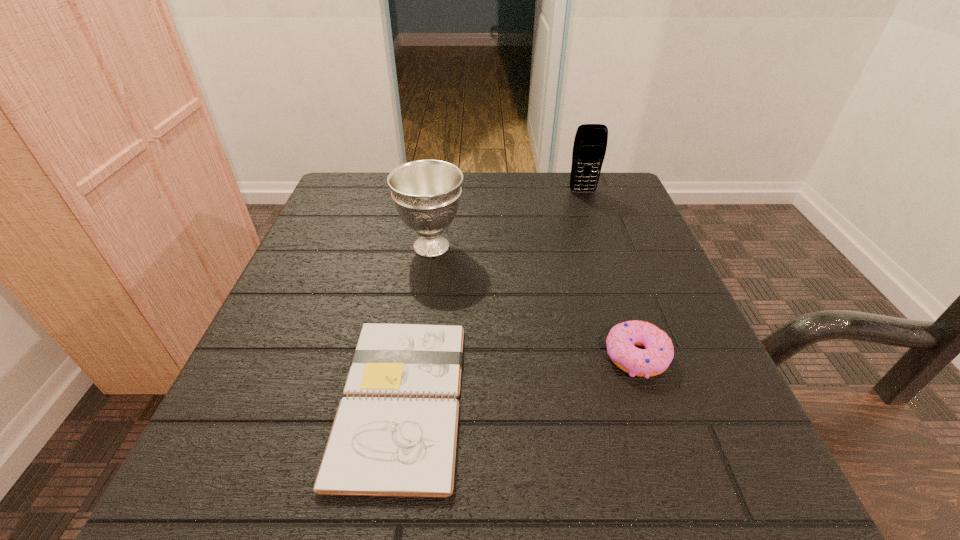
Locate an element on the screen. This screenshot has height=540, width=960. object that is positioned at the left edge is located at coordinates (395, 433).

Image resolution: width=960 pixels, height=540 pixels. What are the coordinates of `cellular telephone located at the right edge` in the screenshot? It's located at (590, 143).

You are a GUI agent. You are given a task and a screenshot of the screen. Output one action in this format:
    pyautogui.click(x=<x>, y=<y>)
    Task: Click on the doughnut that is at the right edge
    The width and height of the screenshot is (960, 540).
    Given the screenshot: What is the action you would take?
    pyautogui.click(x=655, y=358)

Where is `object located at the near left corner`? This screenshot has width=960, height=540. object located at the near left corner is located at coordinates (395, 433).

I want to click on object located in the far right corner section of the desktop, so click(x=590, y=143).

The image size is (960, 540). In the image, there is a desktop. What are the coordinates of `blank space at the far edge` in the screenshot? It's located at (548, 203).

This screenshot has height=540, width=960. Identify the location of vacant space at the near edge of the desktop. (587, 484).

Where is `vacant region at the left edge of the desktop`? The width and height of the screenshot is (960, 540). vacant region at the left edge of the desktop is located at coordinates (321, 430).

This screenshot has width=960, height=540. Identify the location of vacant space at the right edge. (669, 296).

I want to click on free region at the far left corner of the desktop, so click(329, 208).